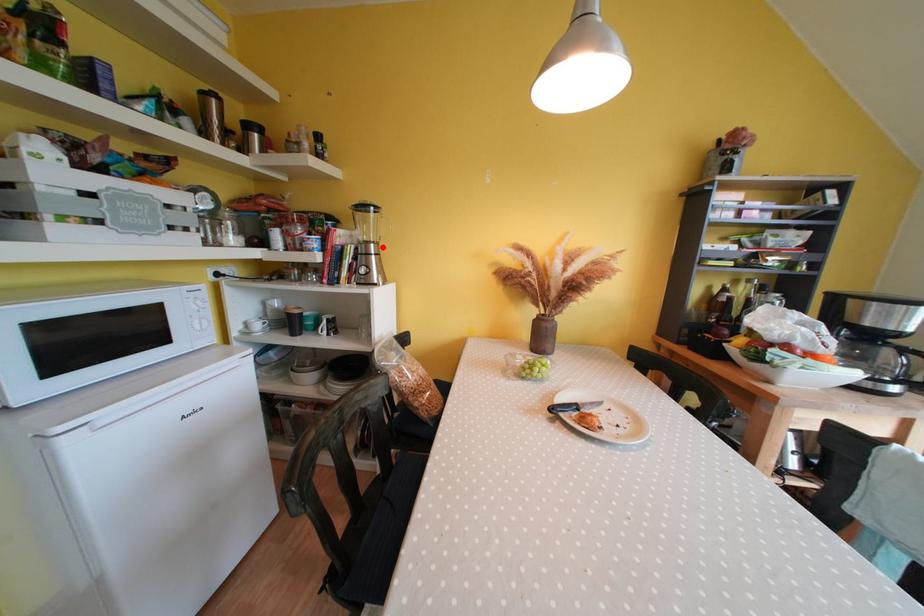
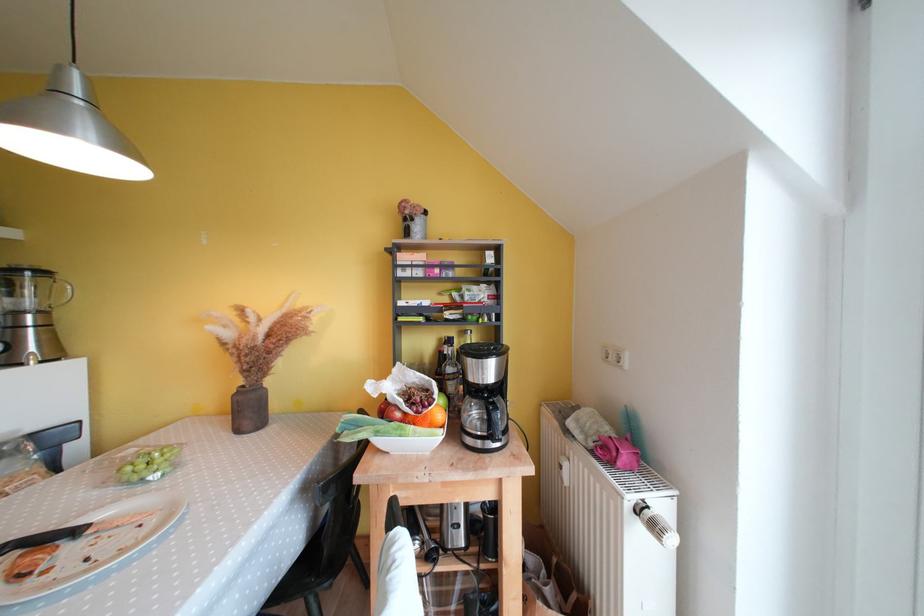
Question: I am providing you with two images of the same scene from different viewpoints. A red point is marked on the first image. Can you still see the location of the red point in image 2?

Choices:
 (A) Yes
 (B) No

Answer: (A)